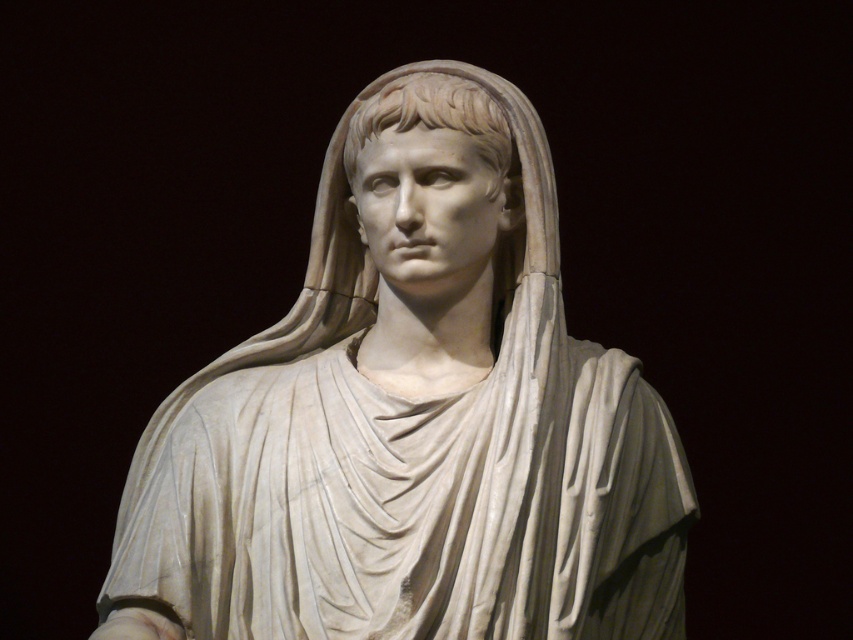
Does point (192, 488) lie behind point (473, 116)?

No, it is not.

Is white marble statue at center taller than white marble head at center?

Correct, white marble statue at center is much taller as white marble head at center.

Is point (544, 486) positioned before point (419, 92)?

Yes.

This screenshot has height=640, width=853. I want to click on white marble statue at center, so click(x=412, y=417).